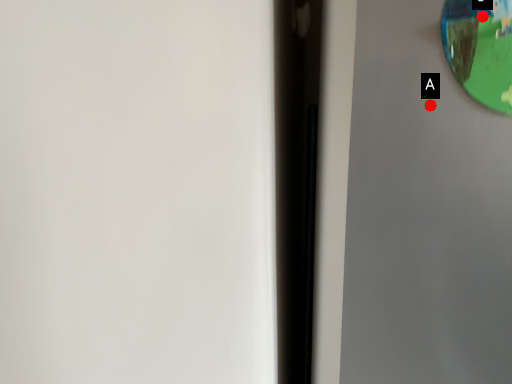
Question: Two points are circled on the image, labeled by A and B beside each circle. Which point is closer to the camera taking this photo?

Choices:
 (A) A is closer
 (B) B is closer

Answer: (B)